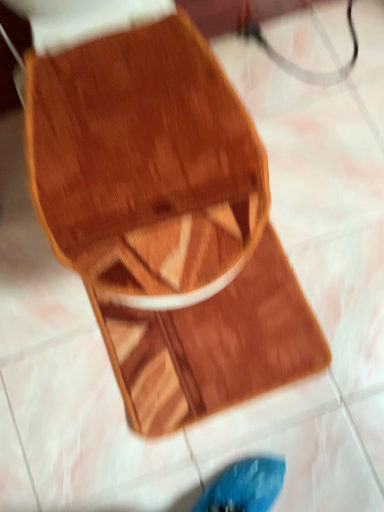
Find the location of a particular element. vacant space situated on the left part of wooden cutting board at center is located at coordinates (53, 370).